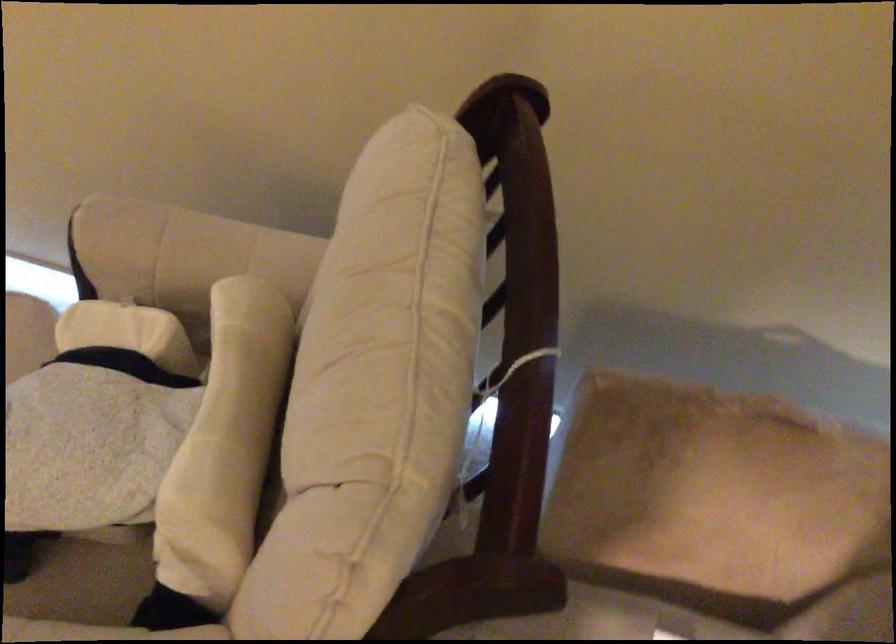
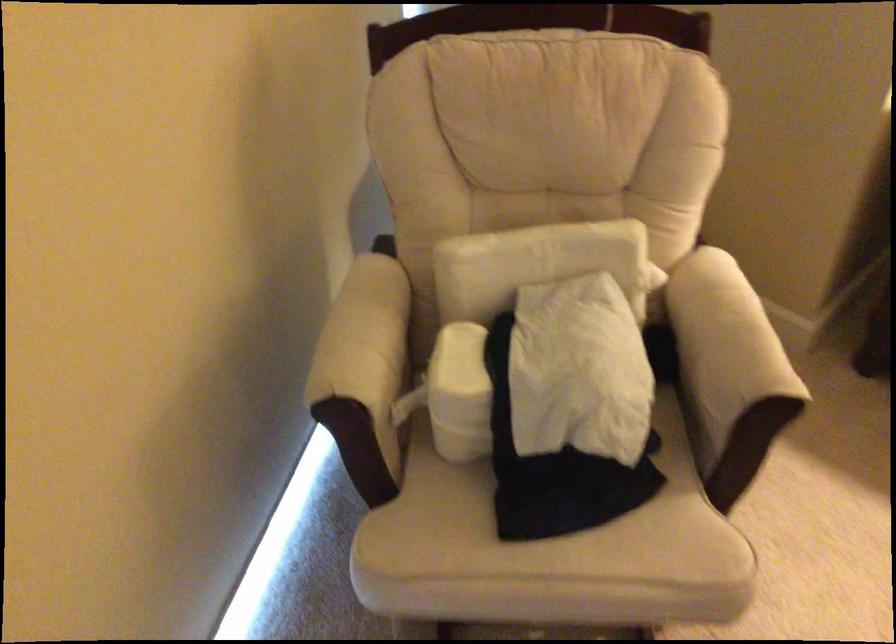
Find the pixel in the second image that matches (71,328) in the first image.

(460, 393)